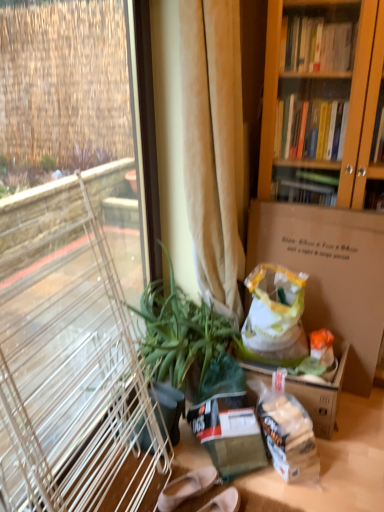
Describe the element at coordinates (213, 146) in the screenshot. I see `beige fabric curtain at center` at that location.

Where is `matte beige shoes at lower center`? matte beige shoes at lower center is located at coordinates coord(186,488).

What is the approximate width of matte beige shoes at lower center?

matte beige shoes at lower center is 3.80 inches wide.

This screenshot has width=384, height=512. I want to click on brown cardboard box at center-right, so (329, 273).

The height and width of the screenshot is (512, 384). I want to click on window above the matte beige shoes at lower center (from the image's perspective), so click(71, 360).

From a real-world perspective, is clear glass window at left positioned above or below matte beige shoes at lower center?

clear glass window at left is above matte beige shoes at lower center.

Looking at this image, from the image's perspective, which is below, clear glass window at left or matte beige shoes at lower center?

matte beige shoes at lower center.

Is clear glass window at left turned away from matte beige shoes at lower center?

No, clear glass window at left is not facing away from matte beige shoes at lower center.

Is clear glass window at left further to camera compared to green matte plant at left?

No, it is not.

How distant is clear glass window at left from green matte plant at left?

clear glass window at left and green matte plant at left are 15.69 inches apart.

Looking at this image, from the image's perspective, which one is positioned higher, clear glass window at left or green matte plant at left?

clear glass window at left is shown above in the image.

In terms of width, does clear glass window at left look wider or thinner when compared to green matte plant at left?

Clearly, clear glass window at left has less width compared to green matte plant at left.

Is matte beige shoes at lower center far away from beige fabric curtain at center?

Yes, matte beige shoes at lower center is far from beige fabric curtain at center.

Where is `curtain that is above the matte beige shoes at lower center (from the image's perspective)`? This screenshot has width=384, height=512. curtain that is above the matte beige shoes at lower center (from the image's perspective) is located at coordinates (213, 146).

Is point (186, 490) in front of point (193, 82)?

No, it is behind (193, 82).

Does green matte plant at left have a lesser height compared to matte beige shoes at lower center?

Incorrect, the height of green matte plant at left does not fall short of that of matte beige shoes at lower center.

Is green matte plant at left situated inside matte beige shoes at lower center or outside?

green matte plant at left is located beyond the bounds of matte beige shoes at lower center.

Can you confirm if green matte plant at left is bigger than matte beige shoes at lower center?

Correct, green matte plant at left is larger in size than matte beige shoes at lower center.

Are green matte plant at left and matte beige shoes at lower center located far from each other?

No, green matte plant at left is in close proximity to matte beige shoes at lower center.

Is brown cardboard box at center-right to the left or to the right of matte beige shoes at lower center in the image?

Clearly, brown cardboard box at center-right is on the right of matte beige shoes at lower center in the image.

Is brown cardboard box at center-right looking in the opposite direction of matte beige shoes at lower center?

brown cardboard box at center-right does not have its back to matte beige shoes at lower center.

Which of these two, brown cardboard box at center-right or matte beige shoes at lower center, is smaller?

matte beige shoes at lower center.

From a real-world perspective, is brown cardboard box at center-right physically below matte beige shoes at lower center?

Actually, brown cardboard box at center-right is physically above matte beige shoes at lower center in the real world.

From the picture: Does beige fabric curtain at center lie in front of matte beige shoes at lower center?

Yes, it is.

Based on the photo, would you consider beige fabric curtain at center to be distant from matte beige shoes at lower center?

That's right, there is a large distance between beige fabric curtain at center and matte beige shoes at lower center.

Considering the relative positions of beige fabric curtain at center and matte beige shoes at lower center in the image provided, is beige fabric curtain at center to the left of matte beige shoes at lower center from the viewer's perspective?

No, beige fabric curtain at center is not to the left of matte beige shoes at lower center.

Consider the image. From a real-world perspective, who is located lower, beige fabric curtain at center or matte beige shoes at lower center?

In real-world perspective, matte beige shoes at lower center is lower.

From the image's perspective, which one is positioned lower, brown cardboard box at center-right or clear glass window at left?

brown cardboard box at center-right.

Looking at this image, is brown cardboard box at center-right positioned with its back to clear glass window at left?

No, clear glass window at left is not at the back of brown cardboard box at center-right.

Who is shorter, brown cardboard box at center-right or clear glass window at left?

With less height is brown cardboard box at center-right.

Is brown cardboard box at center-right in front of or behind clear glass window at left in the image?

Visually, brown cardboard box at center-right is located behind clear glass window at left.

Find the location of a particular element. This screenshot has width=384, height=512. footwear lying below the clear glass window at left (from the image's perspective) is located at coordinates (186, 488).

Where is `window located above the green matte plant at left (from a real-world perspective)`? window located above the green matte plant at left (from a real-world perspective) is located at coordinates (71, 360).

Looking at the image, which one is located further to clear glass window at left, brown cardboard box at center-right or beige fabric curtain at center?

Based on the image, brown cardboard box at center-right appears to be further to clear glass window at left.

Looking at the image, which one is located closer to beige fabric curtain at center, brown cardboard box at center-right or matte beige shoes at lower center?

Based on the image, brown cardboard box at center-right appears to be nearer to beige fabric curtain at center.

When comparing their distances from clear glass window at left, does matte beige shoes at lower center or beige fabric curtain at center seem closer?

beige fabric curtain at center lies closer to clear glass window at left than the other object.

When comparing their distances from matte beige shoes at lower center, does brown cardboard box at center-right or clear glass window at left seem closer?

clear glass window at left.

Estimate the real-world distances between objects in this image. Which object is closer to beige fabric curtain at center, matte beige shoes at lower center or clear glass window at left?

clear glass window at left is closer to beige fabric curtain at center.

Estimate the real-world distances between objects in this image. Which object is further from beige fabric curtain at center, green matte plant at left or brown cardboard box at center-right?

brown cardboard box at center-right.

Estimate the real-world distances between objects in this image. Which object is closer to green matte plant at left, brown cardboard box at center-right or clear glass window at left?

Based on the image, clear glass window at left appears to be nearer to green matte plant at left.

Looking at the image, which one is located further to beige fabric curtain at center, green matte plant at left or matte beige shoes at lower center?

matte beige shoes at lower center is positioned further to the anchor beige fabric curtain at center.

Locate an element on the screen. box between beige fabric curtain at center and green matte plant at left in the vertical direction is located at coordinates (329, 273).

At what (x,y) coordinates should I click in order to perform the action: click on houseplant between clear glass window at left and matte beige shoes at lower center from top to bottom. Please return your answer as a coordinate pair (x, y). This screenshot has width=384, height=512. Looking at the image, I should click on (180, 334).

Find the location of a particular element. curtain located between clear glass window at left and green matte plant at left in the depth direction is located at coordinates (213, 146).

At what (x,y) coordinates should I click in order to perform the action: click on box that lies between beige fabric curtain at center and matte beige shoes at lower center from top to bottom. Please return your answer as a coordinate pair (x, y). This screenshot has height=512, width=384. Looking at the image, I should click on (329, 273).